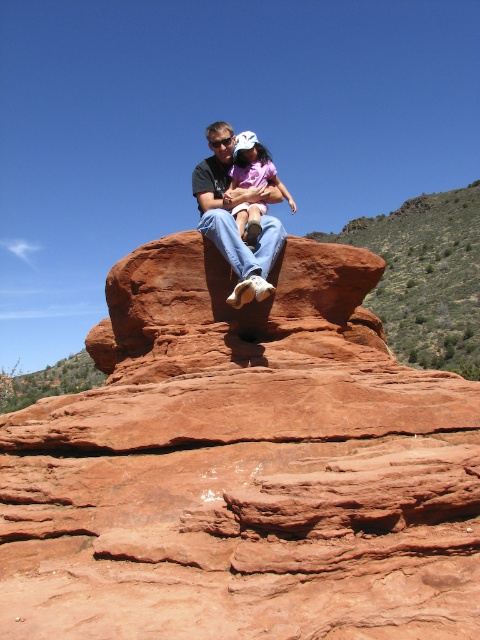
You are standing at the base of the rock formation and want to take a photo of the reddish brown sandstone at upper center. Which direction should you face to ensure the point (242,467) is in the center of your camera viewfinder?

The point (242,467) corresponds to the reddish brown sandstone at upper center. Facing upward and slightly towards the center of the rock formation will position the point in the center of your camera viewfinder.

You are planning to take a photo of the matte black shirt at center and the matte pink shirt at center. Which one should you focus on if you want to capture the larger subject in your frame?

The matte black shirt at center has a larger size compared to the matte pink shirt at center, so you should focus on the matte black shirt at center to capture the larger subject in your frame.